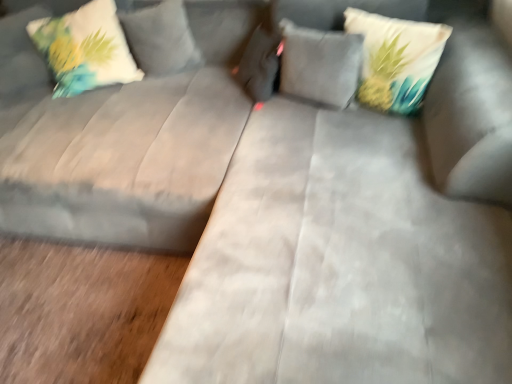
Question: Does printed fabric pillow at upper right, which is the 1th pillow in right-to-left order, have a greater width compared to suede gray pillow at center, which ranks as the 2th pillow in right-to-left order?

Choices:
 (A) yes
 (B) no

Answer: (A)

Question: Is printed fabric pillow at upper right, the third pillow in the left-to-right sequence, not near suede gray pillow at center, the second pillow from the left?

Choices:
 (A) yes
 (B) no

Answer: (B)

Question: Does printed fabric pillow at upper right, the third pillow in the left-to-right sequence, come behind suede gray pillow at center, which ranks as the 2th pillow in right-to-left order?

Choices:
 (A) yes
 (B) no

Answer: (B)

Question: Is printed fabric pillow at upper right, which is the 1th pillow in right-to-left order, next to suede gray pillow at center, which ranks as the 2th pillow in right-to-left order, and touching it?

Choices:
 (A) yes
 (B) no

Answer: (B)

Question: Is printed fabric pillow at upper right, the third pillow in the left-to-right sequence, facing towards suede gray pillow at center, which ranks as the 2th pillow in right-to-left order?

Choices:
 (A) no
 (B) yes

Answer: (A)

Question: From the image's perspective, is printed fabric pillow at upper right, which is the 1th pillow in right-to-left order, located beneath suede gray pillow at center, which ranks as the 2th pillow in right-to-left order?

Choices:
 (A) no
 (B) yes

Answer: (B)

Question: Can we say suede gray couch at center lies outside suede gray pillow at center, which ranks as the 2th pillow in right-to-left order?

Choices:
 (A) no
 (B) yes

Answer: (B)

Question: Can you confirm if suede gray couch at center is thinner than suede gray pillow at center, the second pillow from the left?

Choices:
 (A) no
 (B) yes

Answer: (A)

Question: Does suede gray couch at center come in front of suede gray pillow at center, the second pillow from the left?

Choices:
 (A) yes
 (B) no

Answer: (A)

Question: Is suede gray couch at center taller than suede gray pillow at center, the second pillow from the left?

Choices:
 (A) no
 (B) yes

Answer: (B)

Question: Considering the relative positions of suede gray couch at center and suede gray pillow at center, the second pillow from the left, in the image provided, is suede gray couch at center to the left of suede gray pillow at center, the second pillow from the left, from the viewer's perspective?

Choices:
 (A) no
 (B) yes

Answer: (B)

Question: Is suede gray couch at center not near suede gray pillow at center, which ranks as the 2th pillow in right-to-left order?

Choices:
 (A) yes
 (B) no

Answer: (B)

Question: Considering the relative sizes of suede gray couch at center and white fabric pillow with floral design at upper left, positioned as the third pillow in right-to-left order, in the image provided, is suede gray couch at center bigger than white fabric pillow with floral design at upper left, positioned as the third pillow in right-to-left order,?

Choices:
 (A) yes
 (B) no

Answer: (A)